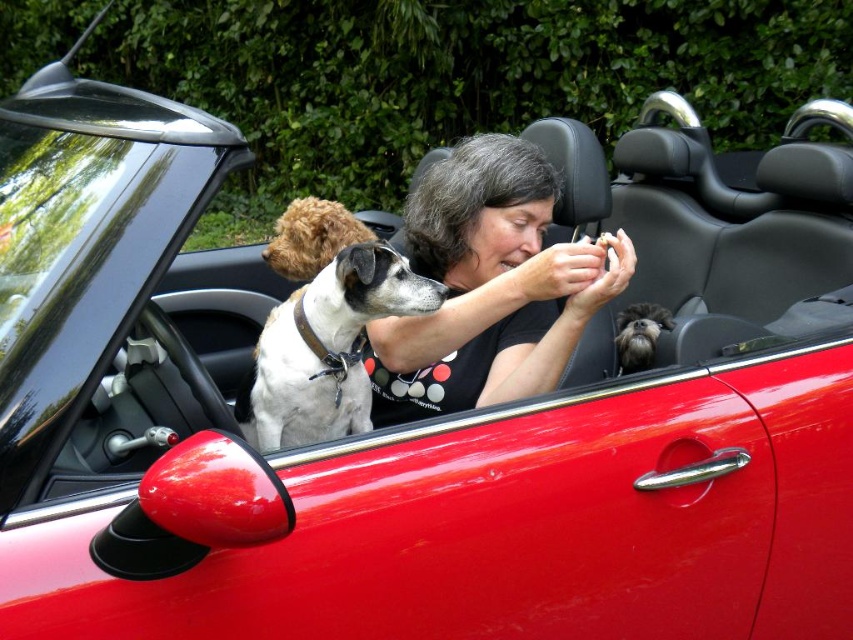
Question: Among these points, which one is nearest to the camera?

Choices:
 (A) (471, 156)
 (B) (265, 250)
 (C) (650, 317)

Answer: (A)

Question: Does white fur dog at center have a lesser width compared to shiny brown fur at center?

Choices:
 (A) yes
 (B) no

Answer: (B)

Question: Estimate the real-world distances between objects in this image. Which object is closer to the shaggy black fur at center?

Choices:
 (A) shiny brown fur at center
 (B) white fur dog at center
 (C) black matte shirt at center

Answer: (C)

Question: Does white fur dog at center have a smaller size compared to shiny brown fur at center?

Choices:
 (A) yes
 (B) no

Answer: (B)

Question: Which point is farther from the camera taking this photo?

Choices:
 (A) (514, 333)
 (B) (329, 212)
 (C) (622, 332)

Answer: (B)

Question: Can you confirm if white fur dog at center is positioned below shaggy black fur at center?

Choices:
 (A) yes
 (B) no

Answer: (A)